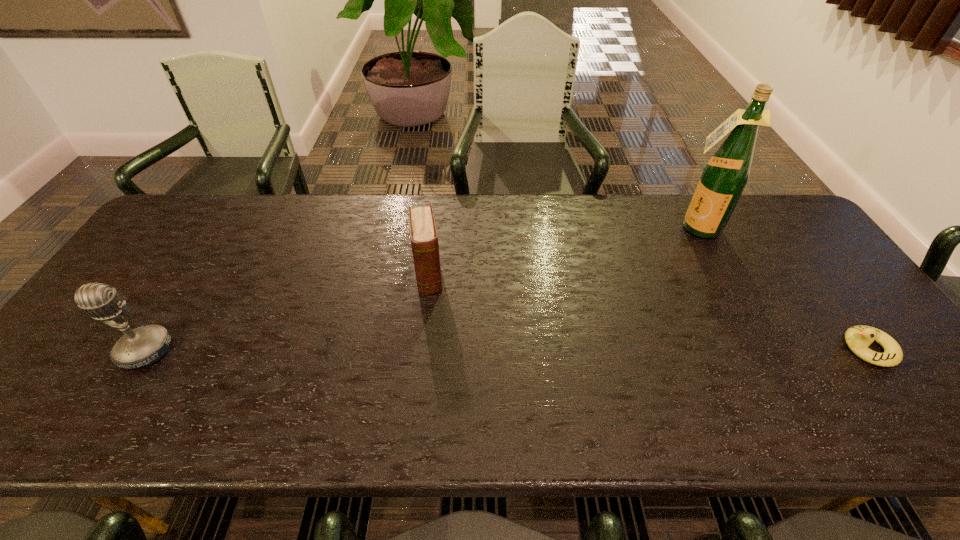
Image resolution: width=960 pixels, height=540 pixels. I want to click on object that is at the left edge, so 143,346.

Find the location of `object at the right edge`. object at the right edge is located at coordinates (858, 338).

What are the coordinates of `object that is positioned at the near left corner` in the screenshot? It's located at (143, 346).

Find the location of a particular element. This screenshot has height=540, width=960. object at the near right corner is located at coordinates (858, 338).

This screenshot has height=540, width=960. Identify the location of vacant space at the far edge of the desktop. (561, 231).

In the image, there is a desktop. What are the coordinates of `free space at the near edge` in the screenshot? It's located at (282, 388).

In the image, there is a desktop. Identify the location of vacant space at the left edge. (179, 255).

Identify the location of free space at the right edge. (816, 287).

Where is `vacant space at the near left corner of the desktop`? Image resolution: width=960 pixels, height=540 pixels. vacant space at the near left corner of the desktop is located at coordinates (84, 396).

The width and height of the screenshot is (960, 540). In the image, there is a desktop. What are the coordinates of `vacant space at the far right corner` in the screenshot? It's located at (800, 240).